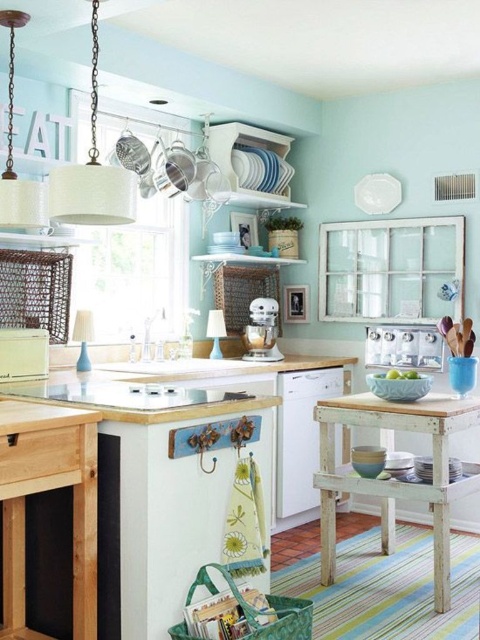
Question: Is white distressed wood table at lower right wider than white glossy sink at center?

Choices:
 (A) yes
 (B) no

Answer: (A)

Question: Which of the following is the farthest from the observer?

Choices:
 (A) (392, 417)
 (B) (372, 349)
 (C) (271, 339)
 (D) (4, 378)

Answer: (B)

Question: Which object is the farthest from the white glossy countertop at center?

Choices:
 (A) white distressed wood table at lower right
 (B) white matte refrigerator at lower left

Answer: (A)

Question: Can you confirm if white matte refrigerator at lower left is bigger than white matte stand mixer at center?

Choices:
 (A) yes
 (B) no

Answer: (B)

Question: From the image, what is the correct spatial relationship of white matte refrigerator at lower left in relation to white matte stand mixer at center?

Choices:
 (A) below
 (B) above

Answer: (A)

Question: Which of the following is the closest to the observer?

Choices:
 (A) white matte refrigerator at lower left
 (B) white matte stand mixer at center

Answer: (A)